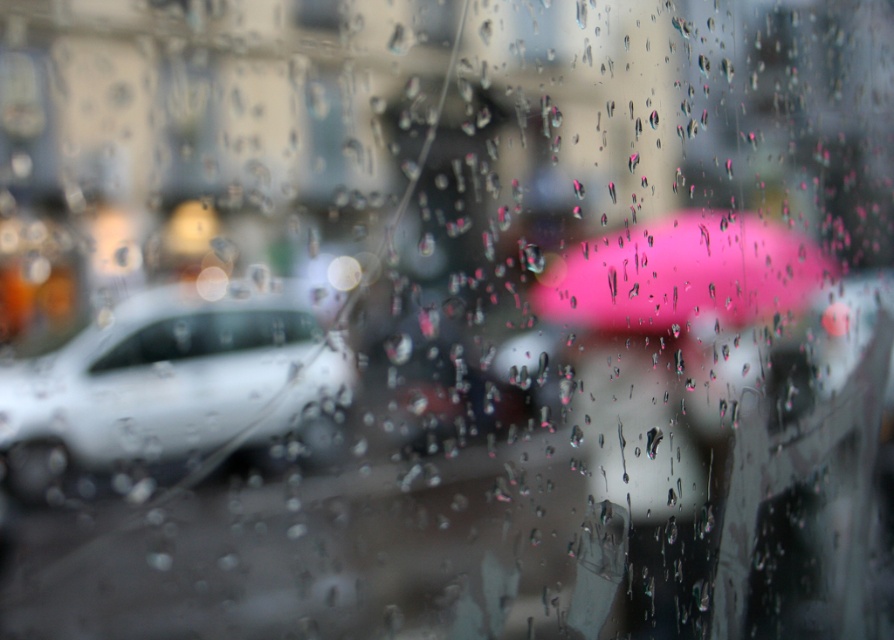
Does white matte car at left lie behind clear glass car at left?

No, white matte car at left is closer to the viewer.

Between point (146, 333) and point (263, 316), which one is positioned behind?

The point (263, 316) is behind.

Is point (205, 413) farther from camera compared to point (226, 310)?

No, (205, 413) is closer to viewer.

Identify the location of white matte car at left. This screenshot has width=894, height=640. (164, 387).

Does point (553, 291) come in front of point (173, 344)?

No, it is behind (173, 344).

Between point (602, 298) and point (171, 342), which one is positioned behind?

Positioned behind is point (602, 298).

Find the location of a particular element. The height and width of the screenshot is (640, 894). pink matte umbrella at center is located at coordinates (682, 275).

Between white matte car at left and pink matte umbrella at center, which one is positioned higher?

Positioned higher is pink matte umbrella at center.

Does white matte car at left appear under pink matte umbrella at center?

Yes, white matte car at left is below pink matte umbrella at center.

Does point (13, 397) lie behind point (614, 314)?

No.

Locate an element on the screen. The height and width of the screenshot is (640, 894). white matte car at left is located at coordinates (164, 387).